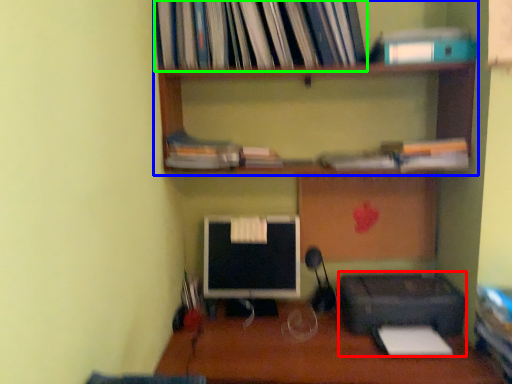
Question: Which object is the closest to the printer (highlighted by a red box)? Choose among these: shelf (highlighted by a blue box) or book (highlighted by a green box).

Choices:
 (A) shelf
 (B) book

Answer: (A)